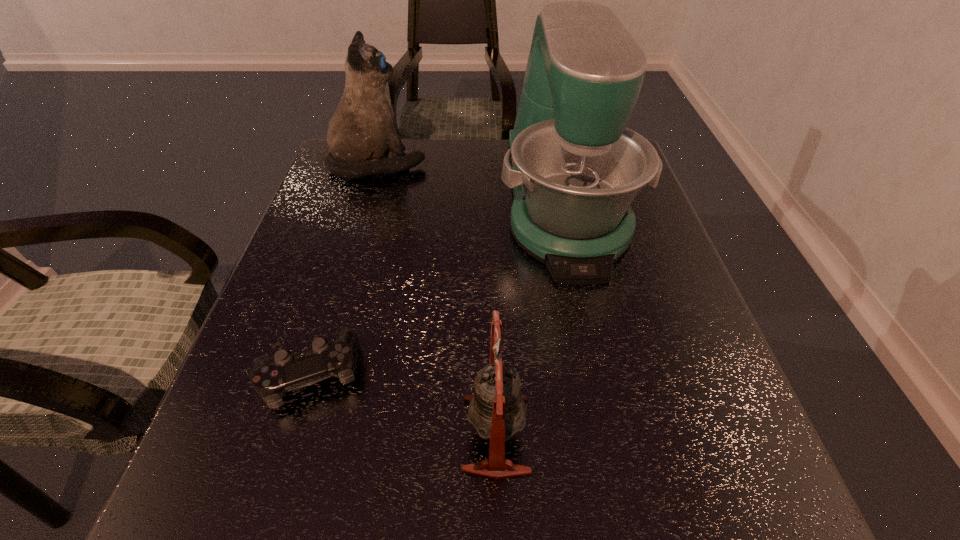
You are a GUI agent. You are given a task and a screenshot of the screen. Output one action in this format:
    pyautogui.click(x=<x>, y=<y>)
    Task: Click on the object that is at the near edge
    
    Given the screenshot: What is the action you would take?
    pyautogui.click(x=497, y=410)

Where is `cat located at the left edge`? The width and height of the screenshot is (960, 540). cat located at the left edge is located at coordinates (363, 130).

The width and height of the screenshot is (960, 540). Identify the location of control present at the left edge. (271, 378).

Image resolution: width=960 pixels, height=540 pixels. What are the coordinates of `object present at the right edge` in the screenshot? It's located at (574, 167).

At what (x,y) coordinates should I click in order to perform the action: click on object that is at the far left corner. Please return your answer as a coordinate pair (x, y). Looking at the image, I should click on (363, 130).

The image size is (960, 540). I want to click on object that is positioned at the far right corner, so click(574, 167).

Where is `free space at the far edge of the desktop`? The height and width of the screenshot is (540, 960). free space at the far edge of the desktop is located at coordinates (427, 152).

This screenshot has width=960, height=540. Find the location of `vacant area at the near edge`. vacant area at the near edge is located at coordinates click(x=502, y=531).

Locate an element on the screen. The height and width of the screenshot is (540, 960). vacant space at the left edge of the desktop is located at coordinates tap(334, 258).

In order to click on vacant area at the right edge in this screenshot , I will do `click(645, 298)`.